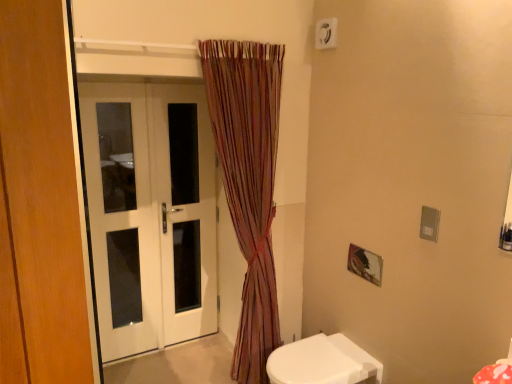
Question: Is white glossy door at left completely or partially outside of white glossy door at left?

Choices:
 (A) yes
 (B) no

Answer: (B)

Question: Does white glossy door at left have a larger size compared to white glossy door at left?

Choices:
 (A) yes
 (B) no

Answer: (B)

Question: Does white glossy door at left touch white glossy door at left?

Choices:
 (A) yes
 (B) no

Answer: (B)

Question: Does white glossy door at left have a smaller size compared to white glossy door at left?

Choices:
 (A) yes
 (B) no

Answer: (A)

Question: Is white glossy door at left taller than white glossy door at left?

Choices:
 (A) yes
 (B) no

Answer: (B)

Question: Is white glossy door at left surrounded by white glossy door at left?

Choices:
 (A) no
 (B) yes

Answer: (B)

Question: Is white glossy toilet at lower right aimed at striped fabric curtain at center?

Choices:
 (A) yes
 (B) no

Answer: (B)

Question: From the image's perspective, does white glossy toilet at lower right appear higher than striped fabric curtain at center?

Choices:
 (A) yes
 (B) no

Answer: (B)

Question: From a real-world perspective, is white glossy toilet at lower right positioned over striped fabric curtain at center based on gravity?

Choices:
 (A) no
 (B) yes

Answer: (A)

Question: Is striped fabric curtain at center at the back of white glossy toilet at lower right?

Choices:
 (A) no
 (B) yes

Answer: (A)

Question: Is striped fabric curtain at center located within white glossy toilet at lower right?

Choices:
 (A) yes
 (B) no

Answer: (B)

Question: From the image's perspective, does white glossy toilet at lower right appear lower than striped fabric curtain at center?

Choices:
 (A) no
 (B) yes

Answer: (B)

Question: From the image's perspective, is white plastic electric outlet at upper center on top of white glossy toilet at lower right?

Choices:
 (A) yes
 (B) no

Answer: (A)